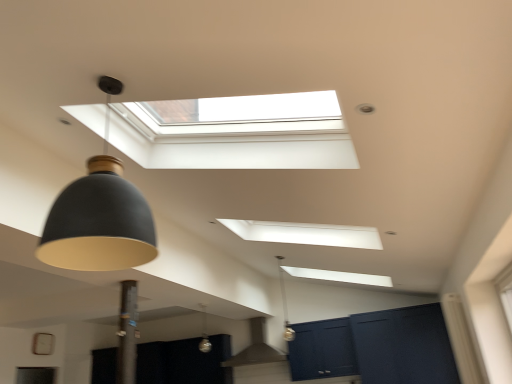
Question: Can you confirm if matte gray exhaust hood at center is wider than matte black lampshade at left, placed as the 2th lamp when sorted from left to right?

Choices:
 (A) yes
 (B) no

Answer: (A)

Question: Is matte gray exhaust hood at center closer to the viewer compared to matte black lampshade at left, placed as the 2th lamp when sorted from left to right?

Choices:
 (A) no
 (B) yes

Answer: (A)

Question: Is matte gray exhaust hood at center not near matte black lampshade at left, placed as the 2th lamp when sorted from left to right?

Choices:
 (A) yes
 (B) no

Answer: (A)

Question: Is matte gray exhaust hood at center behind matte black lampshade at left, marked as the 1th lamp in a front-to-back arrangement?

Choices:
 (A) no
 (B) yes

Answer: (B)

Question: Is matte gray exhaust hood at center at the right side of matte black lampshade at left, which is the 3th lamp from back to front?

Choices:
 (A) yes
 (B) no

Answer: (A)

Question: In terms of width, does satin silver glass at center, the third lamp positioned from the right, look wider or thinner when compared to matte black lampshade at left, which is the second lamp in right-to-left order?

Choices:
 (A) wide
 (B) thin

Answer: (B)

Question: Is satin silver glass at center, the third lamp positioned from the right, to the left or to the right of matte black lampshade at left, which is the second lamp in right-to-left order, in the image?

Choices:
 (A) left
 (B) right

Answer: (A)

Question: Does point (206, 347) appear closer or farther from the camera than point (77, 231)?

Choices:
 (A) closer
 (B) farther

Answer: (B)

Question: From the image's perspective, is satin silver glass at center, acting as the third lamp starting from the top, above or below matte black lampshade at left, which is the 3th lamp from back to front?

Choices:
 (A) below
 (B) above

Answer: (A)

Question: From their relative heights in the image, would you say matte gray exhaust hood at center is taller or shorter than matte black lampshade at left, which is the 3th lamp from back to front?

Choices:
 (A) short
 (B) tall

Answer: (A)

Question: Considering the positions of matte gray exhaust hood at center and matte black lampshade at left, placed as the 2th lamp when sorted from left to right, in the image, is matte gray exhaust hood at center bigger or smaller than matte black lampshade at left, placed as the 2th lamp when sorted from left to right,?

Choices:
 (A) big
 (B) small

Answer: (A)

Question: Considering the positions of matte gray exhaust hood at center and matte black lampshade at left, placed as the 2th lamp when sorted from left to right, in the image, is matte gray exhaust hood at center wider or thinner than matte black lampshade at left, placed as the 2th lamp when sorted from left to right,?

Choices:
 (A) wide
 (B) thin

Answer: (A)

Question: From the image's perspective, is matte gray exhaust hood at center positioned above or below matte black lampshade at left, which is the second lamp in right-to-left order?

Choices:
 (A) above
 (B) below

Answer: (B)

Question: From the image's perspective, is matte dark blue cabinet at lower right located above or below satin silver glass at center, acting as the third lamp starting from the top?

Choices:
 (A) above
 (B) below

Answer: (B)

Question: Is matte dark blue cabinet at lower right bigger or smaller than satin silver glass at center, arranged as the third lamp when viewed from the front?

Choices:
 (A) big
 (B) small

Answer: (A)